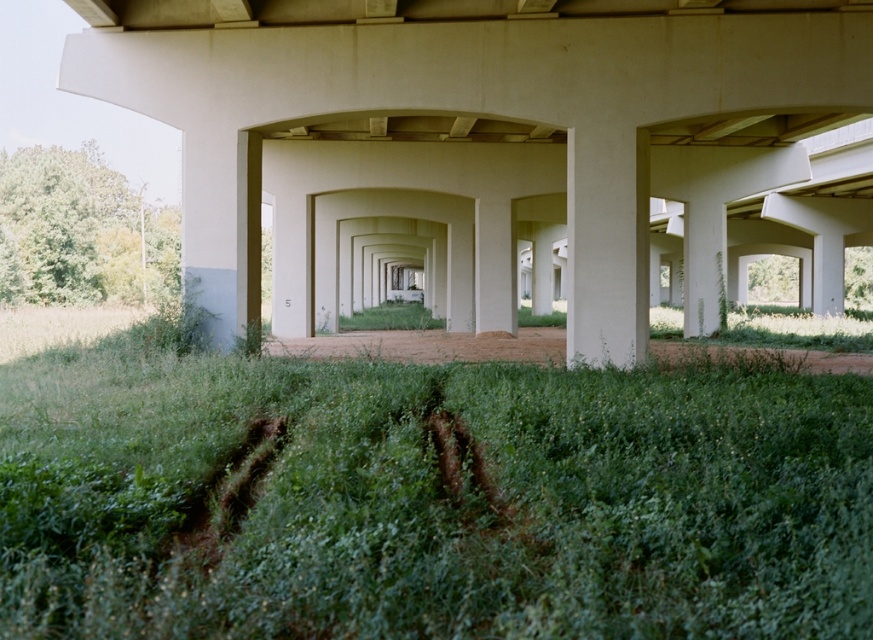
You are standing at the entrance of the arch tunnel and want to reach the point marked as point (x=684, y=372). If your walking speed is 1.5 meters per second, how many seconds will it take you to reach the point?

The distance between you and point (x=684, y=372) is 11.90 meters. At a walking speed of 1.5 meters per second, it will take approximately 7.93 seconds to reach the point.

Based on the photo, you are a construction worker assessing the tunnel structure. You need to determine if the green grass at center can be mowed without damaging the white smooth concrete pillar at center. Based on their heights, what should you consider?

The green grass at center is shorter than the white smooth concrete pillar at center, so mowing the grass should not damage the pillar as it is taller and will not be affected by the mower.